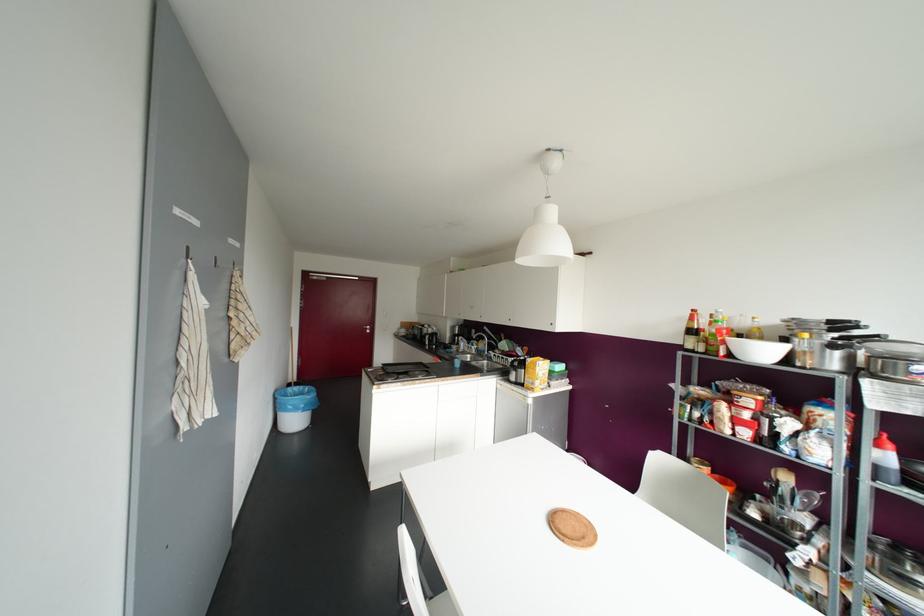
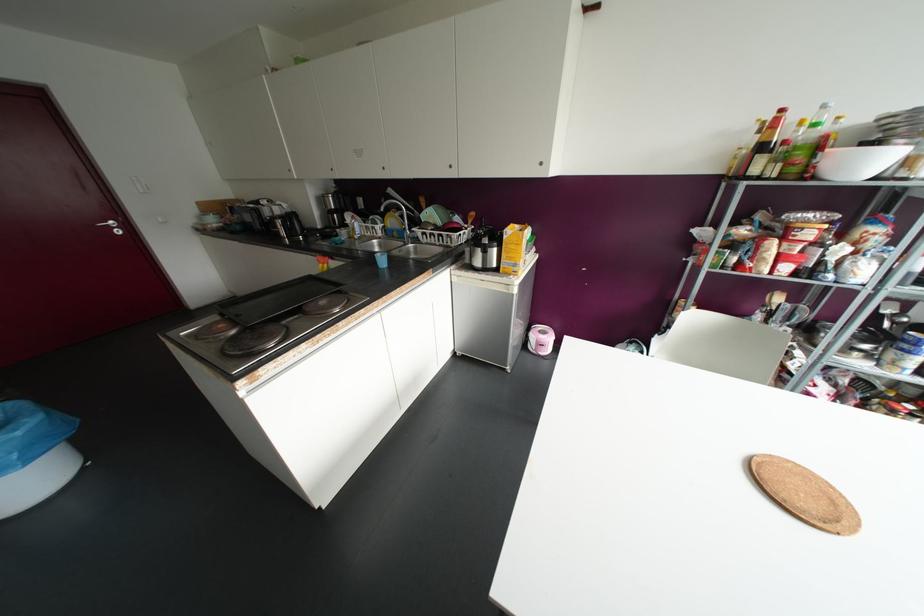
Find the pixel in the second image that matches [456,363] in the first image.

(382, 261)